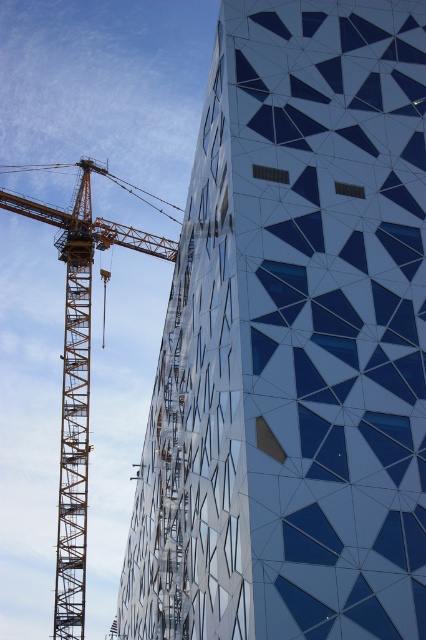
Question: Does white glass building at center appear on the left side of orange metallic crane at left?

Choices:
 (A) yes
 (B) no

Answer: (B)

Question: Where is white glass building at center located in relation to orange metallic crane at left in the image?

Choices:
 (A) above
 (B) below

Answer: (B)

Question: Which point appears closest to the camera in this image?

Choices:
 (A) (333, 118)
 (B) (86, 202)

Answer: (A)

Question: Is white glass building at center smaller than orange metallic crane at left?

Choices:
 (A) yes
 (B) no

Answer: (A)

Question: Which of the following is the farthest from the observer?

Choices:
 (A) orange metallic crane at left
 (B) white glass building at center

Answer: (A)

Question: Among these objects, which one is farthest from the camera?

Choices:
 (A) white glass building at center
 (B) orange metallic crane at left

Answer: (B)